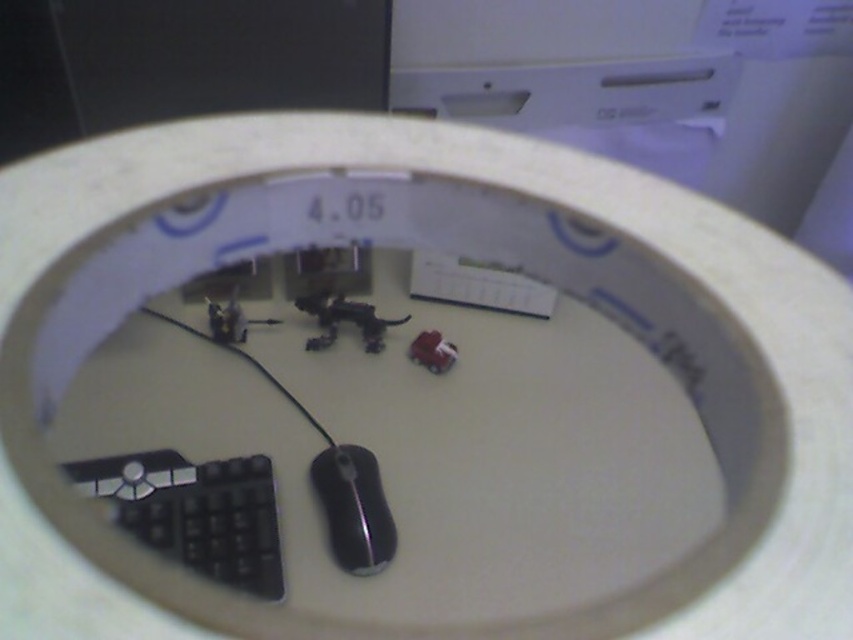
Question: Considering the real-world distances, which object is closest to the black glossy mouse at center?

Choices:
 (A) black matte keyboard at lower left
 (B) matte plastic toy car at center
 (C) metallic plastic toy at center

Answer: (A)

Question: Which object is closer to the camera taking this photo?

Choices:
 (A) black matte keyboard at lower left
 (B) black glossy mouse at center
 (C) metallic plastic toy at center

Answer: (A)

Question: Is the position of metallic plastic toy at center less distant than that of matte plastic toy car at center?

Choices:
 (A) no
 (B) yes

Answer: (A)

Question: Can you confirm if black glossy mouse at center is positioned to the left of metallic plastic toy at center?

Choices:
 (A) yes
 (B) no

Answer: (B)

Question: Which point appears closest to the camera in this image?

Choices:
 (A) (178, 460)
 (B) (421, 346)
 (C) (343, 307)

Answer: (A)

Question: Can you confirm if black matte keyboard at lower left is smaller than matte plastic toy car at center?

Choices:
 (A) yes
 (B) no

Answer: (B)